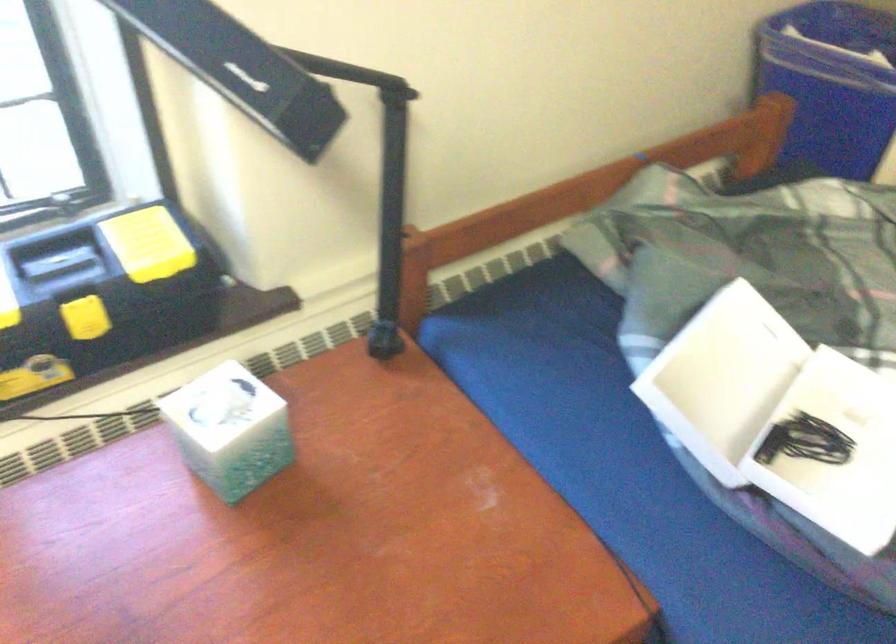
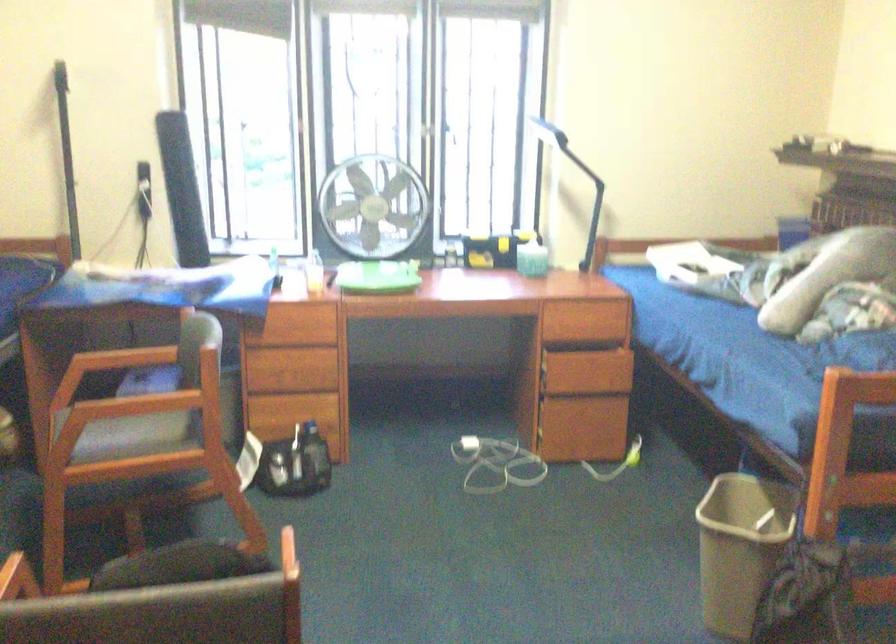
Question: I am providing you with two images of the same scene from different viewpoints. After the viewpoint changes to image2, which objects are now occluded?

Choices:
 (A) black rotary switch
 (B) green plastic tray
 (C) black desk lamp
 (D) black lamp head

Answer: (D)